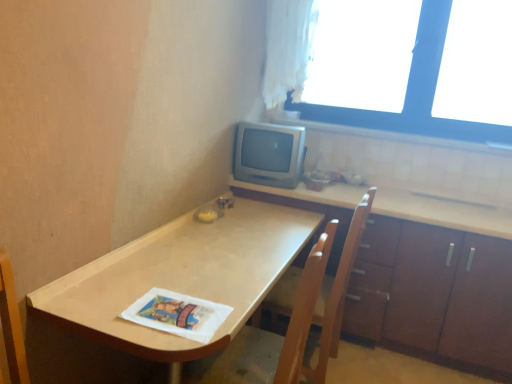
Question: Can you confirm if white sheer curtain at upper right is positioned to the left of brown wood cabinet at lower right?

Choices:
 (A) yes
 (B) no

Answer: (A)

Question: Would you say white sheer curtain at upper right is a long distance from brown wood cabinet at lower right?

Choices:
 (A) no
 (B) yes

Answer: (B)

Question: Could brown wood cabinet at lower right be considered to be inside white sheer curtain at upper right?

Choices:
 (A) no
 (B) yes

Answer: (A)

Question: Considering the relative sizes of white sheer curtain at upper right and brown wood cabinet at lower right in the image provided, is white sheer curtain at upper right wider than brown wood cabinet at lower right?

Choices:
 (A) yes
 (B) no

Answer: (B)

Question: Is white sheer curtain at upper right placed right next to brown wood cabinet at lower right?

Choices:
 (A) yes
 (B) no

Answer: (B)

Question: From the image's perspective, is brown wood cabinet at lower right located above or below matte wood table at center?

Choices:
 (A) below
 (B) above

Answer: (B)

Question: Is brown wood cabinet at lower right to the left or to the right of matte wood table at center in the image?

Choices:
 (A) right
 (B) left

Answer: (A)

Question: Is point (473, 286) closer or farther from the camera than point (74, 316)?

Choices:
 (A) farther
 (B) closer

Answer: (A)

Question: Looking at the image, does brown wood cabinet at lower right seem bigger or smaller compared to matte wood table at center?

Choices:
 (A) small
 (B) big

Answer: (B)

Question: Is satin silver monitor at upper right taller or shorter than white paper magazine at lower center?

Choices:
 (A) short
 (B) tall

Answer: (B)

Question: In terms of size, does satin silver monitor at upper right appear bigger or smaller than white paper magazine at lower center?

Choices:
 (A) small
 (B) big

Answer: (B)

Question: Which is correct: satin silver monitor at upper right is inside white paper magazine at lower center, or outside of it?

Choices:
 (A) inside
 (B) outside

Answer: (B)

Question: From the image's perspective, is satin silver monitor at upper right above or below white paper magazine at lower center?

Choices:
 (A) above
 (B) below

Answer: (A)

Question: Which is correct: white sheer curtain at upper right is inside wooden chair at center, or outside of it?

Choices:
 (A) inside
 (B) outside

Answer: (B)

Question: In terms of height, does white sheer curtain at upper right look taller or shorter compared to wooden chair at center?

Choices:
 (A) short
 (B) tall

Answer: (A)